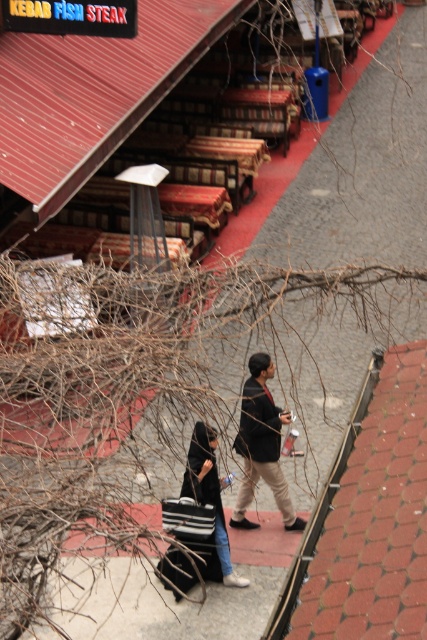
You are a photographer trying to capture a clear shot of the two people walking in the urban street scene. The dark brown leather jacket at center and the black fabric bag at center are in your frame. Since the tree branches are blocking part of the view, you need to adjust your camera angle to ensure both objects are fully visible. Which object should you prioritize keeping in the frame if you can only focus on one due to the limited space caused by the branches?

You should prioritize keeping the dark brown leather jacket at center in the frame because it has a greater height compared to the black fabric bag at center, making it more prominent and likely more important for the composition.

Looking at this image, you are a delivery person who needs to deliver a package to the person carrying the black fabric bag at center and the striped fabric shopping bag at lower center. Which bag should you hand the package to?

The black fabric bag at center is to the right of striped fabric shopping bag at lower center. Therefore, you should hand the package to the person carrying the black fabric bag at center since it is positioned to the right of the striped fabric shopping bag at lower center.